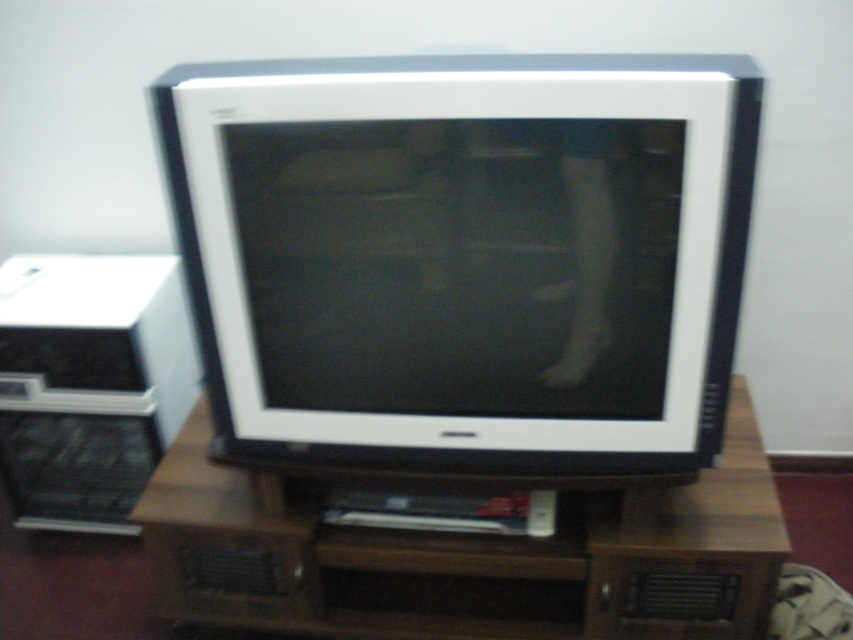
Is white plastic monitor at center to the left of brown wood entertainment center at center from the viewer's perspective?

Incorrect, white plastic monitor at center is not on the left side of brown wood entertainment center at center.

How much distance is there between white plastic monitor at center and brown wood entertainment center at center?

They are 37.23 centimeters apart.

Is point (659, 369) positioned after point (523, 548)?

No, it is not.

I want to click on white plastic monitor at center, so click(x=463, y=257).